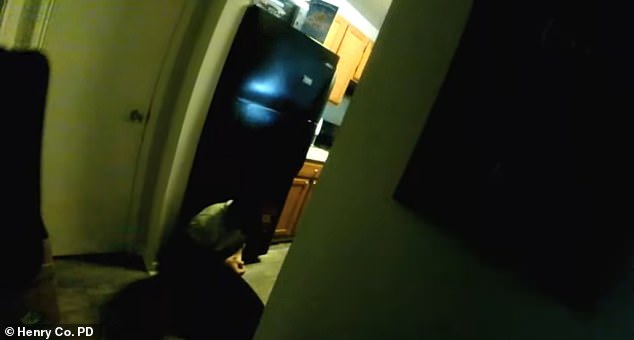
The height and width of the screenshot is (340, 634). Identify the location of kitchen area. (326, 140).